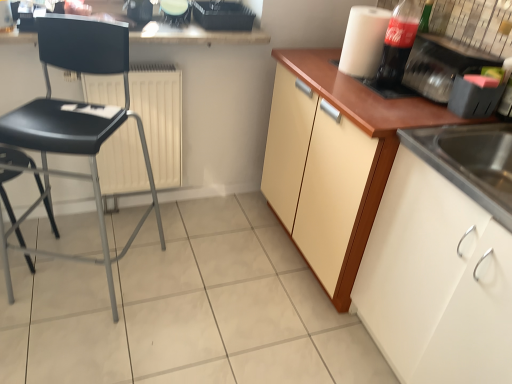
At what (x,y) coordinates should I click in order to perform the action: click on free space on the front side of metallic silver toaster at upper right, the 3th appliance positioned from the left. Please return your answer as a coordinate pair (x, y). Looking at the image, I should click on [x=418, y=113].